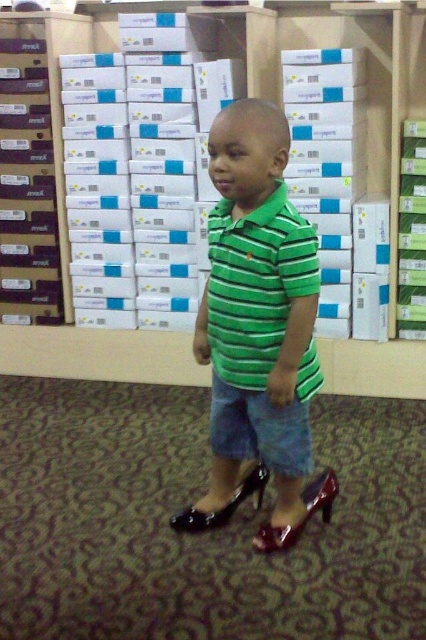
Question: Which object appears farthest from the camera in this image?

Choices:
 (A) shiny black high-heeled shoe at lower center
 (B) shiny burgundy sandal at lower center

Answer: (A)

Question: Is green striped polo shirt at center positioned at the back of shiny burgundy sandal at lower center?

Choices:
 (A) yes
 (B) no

Answer: (B)

Question: Does green striped shirt at center appear on the right side of green striped polo shirt at center?

Choices:
 (A) yes
 (B) no

Answer: (B)

Question: Which point is closer to the camera?

Choices:
 (A) green striped polo shirt at center
 (B) shiny black high-heeled shoe at lower center

Answer: (A)

Question: Which point is farther from the camera taking this photo?

Choices:
 (A) (247, 339)
 (B) (226, 337)
 (C) (233, 502)

Answer: (C)

Question: Is white cardboard boxes at center bigger than shiny black high-heeled shoe at lower center?

Choices:
 (A) no
 (B) yes

Answer: (B)